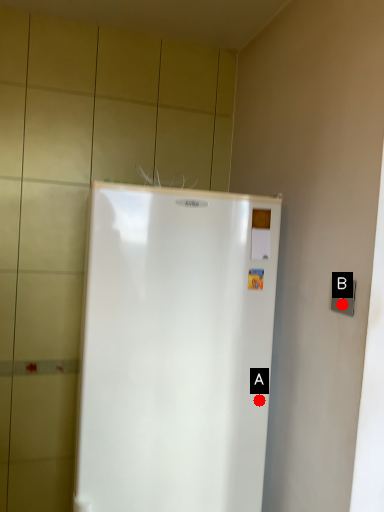
Question: Two points are circled on the image, labeled by A and B beside each circle. Which point is further to the camera?

Choices:
 (A) A is further
 (B) B is further

Answer: (A)